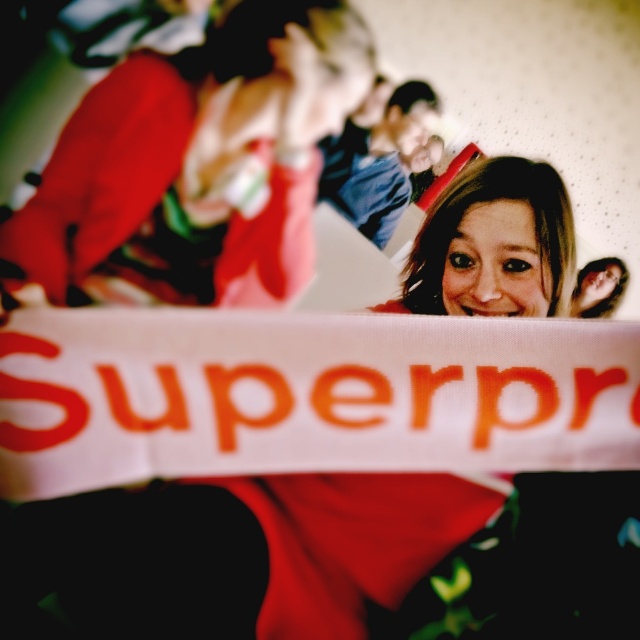
Who is higher up, white fabric sign at center or matte red hoodie at upper left?

Positioned higher is matte red hoodie at upper left.

Between point (428, 445) and point (250, 124), which one is positioned in front?

Point (428, 445) is in front.

Locate an element on the screen. This screenshot has width=640, height=640. white fabric sign at center is located at coordinates (307, 394).